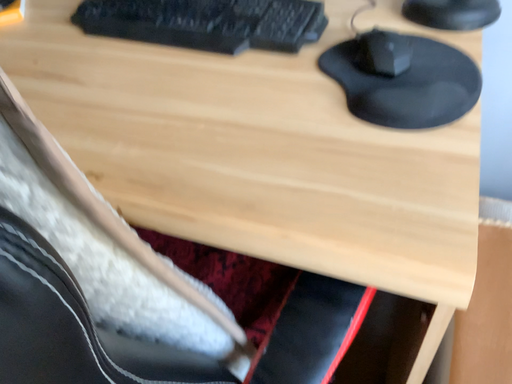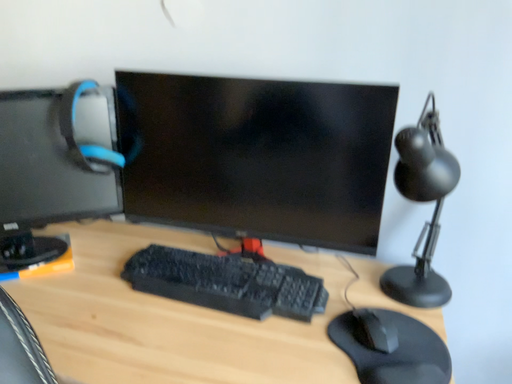
Question: Which way did the camera rotate in the video?

Choices:
 (A) rotated right
 (B) rotated left

Answer: (A)